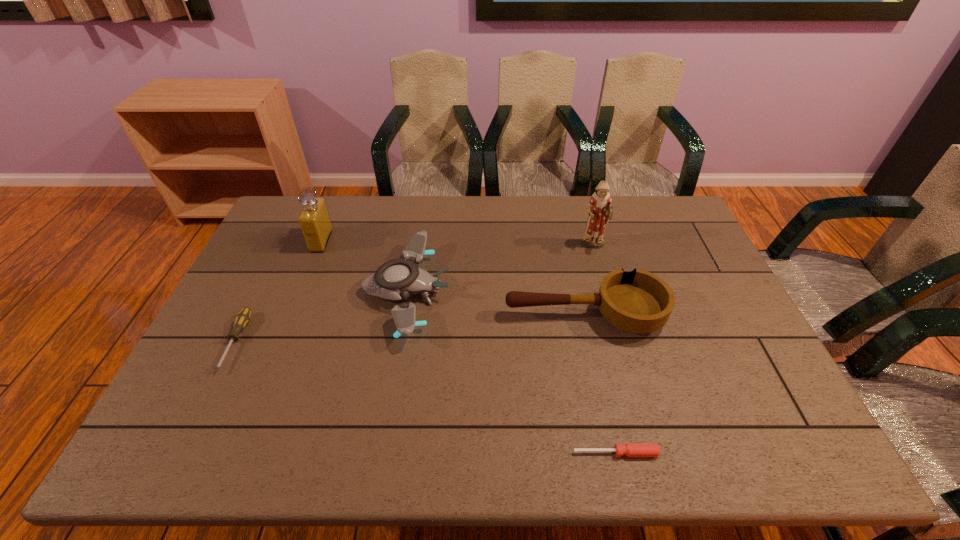
At what (x,y) coordinates should I click in order to perform the action: click on the tallest object. Please return your answer as a coordinate pair (x, y). This screenshot has height=540, width=960. Looking at the image, I should click on (599, 209).

The height and width of the screenshot is (540, 960). I want to click on the second object from left to right, so click(314, 219).

Where is `the fifth shortest object`? This screenshot has width=960, height=540. the fifth shortest object is located at coordinates (314, 219).

Where is `saucepan`? saucepan is located at coordinates (638, 301).

Find the location of a particular element. The height and width of the screenshot is (540, 960). the fourth object from right to left is located at coordinates (397, 279).

Identify the location of the second shortest object. (242, 318).

Where is `the left screwdriver`? The image size is (960, 540). the left screwdriver is located at coordinates (242, 318).

Find the location of a particular element. The height and width of the screenshot is (540, 960). the shortest object is located at coordinates tap(629, 449).

This screenshot has height=540, width=960. Identify the location of the shorter screwdriver. (629, 449).

Identify the location of free point located on the front-facing side of the figurine. (614, 321).